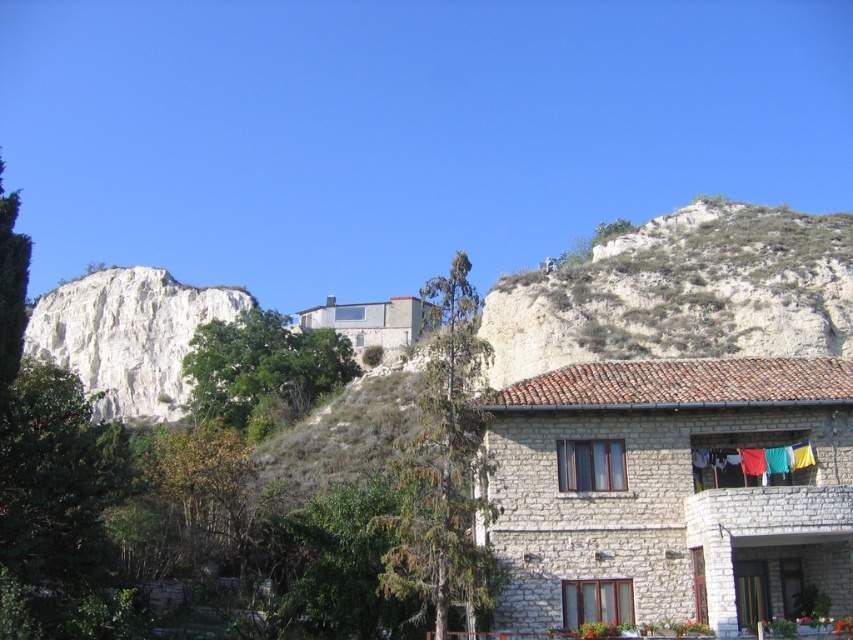
Consider the image. You are standing in front of the stone house and see the green leafy tree at center and the green leafy tree at upper center. Which tree is closer to you?

The green leafy tree at center is closer to you because it is in front of the green leafy tree at upper center.

You are standing at the front door of the stone house. Looking out, you notice a point marked at coordinates (444, 467). What object does this point correspond to in the scene?

The point at coordinates (444, 467) corresponds to the green leafy tree at center.

You are standing in front of the stone house and want to determine the relative positions of two points marked in the image. Which of the two points, point [467,397] or point [751,470], is closer to you?

Point [467,397] is closer to the viewer than point [751,470].